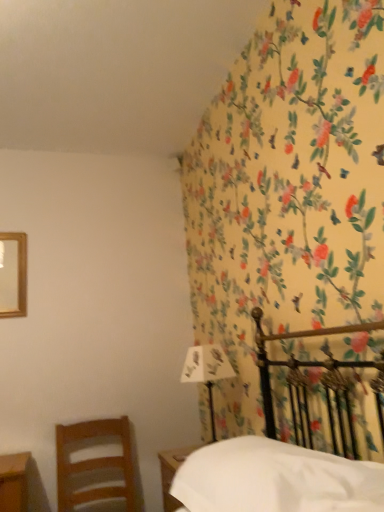
Question: Considering the relative sizes of white matte sheet at lower right and wooden chair at left in the image provided, is white matte sheet at lower right wider than wooden chair at left?

Choices:
 (A) yes
 (B) no

Answer: (B)

Question: Is wooden chair at left a part of white matte sheet at lower right?

Choices:
 (A) yes
 (B) no

Answer: (B)

Question: Does white matte sheet at lower right have a greater height compared to wooden chair at left?

Choices:
 (A) no
 (B) yes

Answer: (A)

Question: Is white matte sheet at lower right outside of wooden chair at left?

Choices:
 (A) yes
 (B) no

Answer: (A)

Question: Is white matte sheet at lower right positioned in front of wooden chair at left?

Choices:
 (A) yes
 (B) no

Answer: (A)

Question: Considering the positions of wooden chair at left and white matte sheet at lower right in the image, is wooden chair at left bigger or smaller than white matte sheet at lower right?

Choices:
 (A) big
 (B) small

Answer: (B)

Question: Choose the correct answer: Is wooden chair at left inside white matte sheet at lower right or outside it?

Choices:
 (A) inside
 (B) outside

Answer: (B)

Question: Considering their positions, is wooden chair at left located in front of or behind white matte sheet at lower right?

Choices:
 (A) front
 (B) behind

Answer: (B)

Question: From a real-world perspective, is wooden chair at left above or below white matte sheet at lower right?

Choices:
 (A) below
 (B) above

Answer: (A)

Question: In the image, is wooden chair at left on the left side or the right side of white paper at upper right?

Choices:
 (A) left
 (B) right

Answer: (A)

Question: Is wooden chair at left inside or outside of white paper at upper right?

Choices:
 (A) outside
 (B) inside

Answer: (A)

Question: Is point (87, 501) positioned closer to the camera than point (216, 360)?

Choices:
 (A) farther
 (B) closer

Answer: (A)

Question: Looking at their shapes, would you say wooden chair at left is wider or thinner than white paper at upper right?

Choices:
 (A) wide
 (B) thin

Answer: (A)

Question: From a real-world perspective, is white matte sheet at lower right physically located above or below wooden chair at left?

Choices:
 (A) above
 (B) below

Answer: (A)

Question: Looking at the image, does white matte sheet at lower right seem bigger or smaller compared to wooden chair at left?

Choices:
 (A) big
 (B) small

Answer: (A)